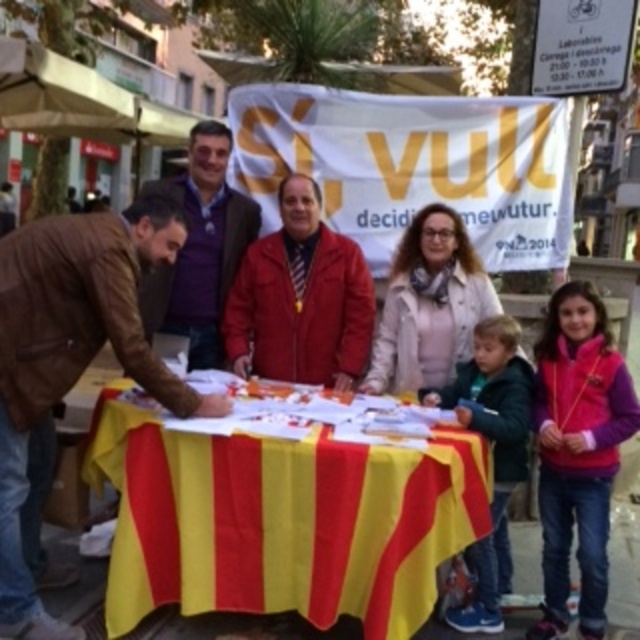
Between yellow/red striped fabric at center and pink fleece vest at lower right, which one appears on the right side from the viewer's perspective?

From the viewer's perspective, pink fleece vest at lower right appears more on the right side.

Is the position of yellow/red striped fabric at center more distant than that of pink fleece vest at lower right?

No, it is in front of pink fleece vest at lower right.

Does point (365, 628) lie behind point (541, 378)?

No, it is not.

Where is `yellow/red striped fabric at center`? yellow/red striped fabric at center is located at coordinates (282, 520).

Between purple soft shirt at center and dark green jacket at lower center, which one appears on the right side from the viewer's perspective?

From the viewer's perspective, dark green jacket at lower center appears more on the right side.

Does point (205, 244) come farther from viewer compared to point (424, 404)?

Yes, point (205, 244) is farther from viewer.

You are a GUI agent. You are given a task and a screenshot of the screen. Output one action in this format:
    pyautogui.click(x=<x>, y=<y>)
    Task: Click on the purple soft shirt at center
    Image resolution: width=640 pixels, height=640 pixels.
    Given the screenshot: What is the action you would take?
    pyautogui.click(x=200, y=250)

Between pink fleece vest at lower right and dark green jacket at lower center, which one appears on the right side from the viewer's perspective?

pink fleece vest at lower right

This screenshot has width=640, height=640. What are the coordinates of `pink fleece vest at lower right` in the screenshot? It's located at (577, 451).

Which is behind, point (554, 486) or point (496, 384)?

The point (496, 384) is more distant.

You are a GUI agent. You are given a task and a screenshot of the screen. Output one action in this format:
    pyautogui.click(x=<x>, y=<y>)
    Task: Click on the pink fleece vest at lower right
    The width and height of the screenshot is (640, 640).
    Given the screenshot: What is the action you would take?
    pyautogui.click(x=577, y=451)